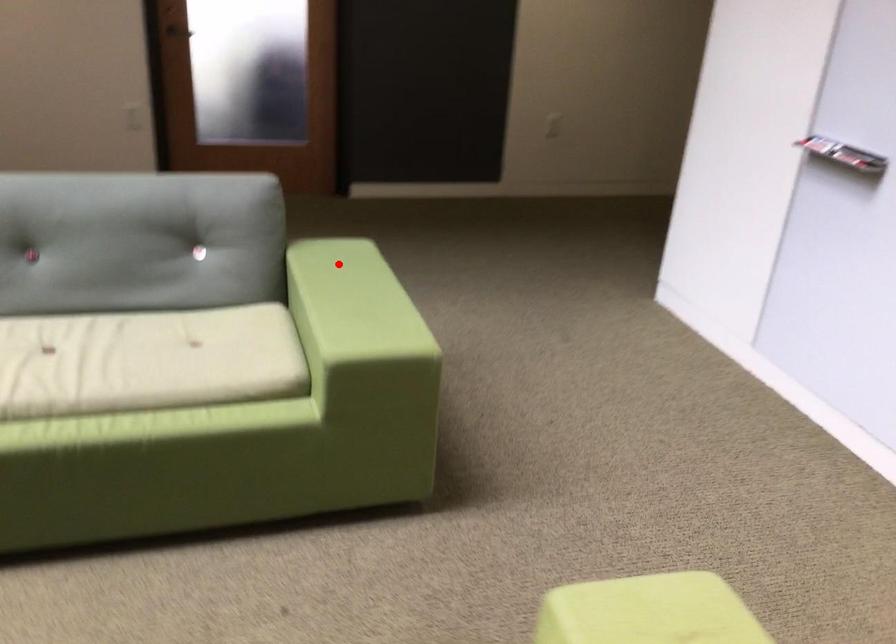
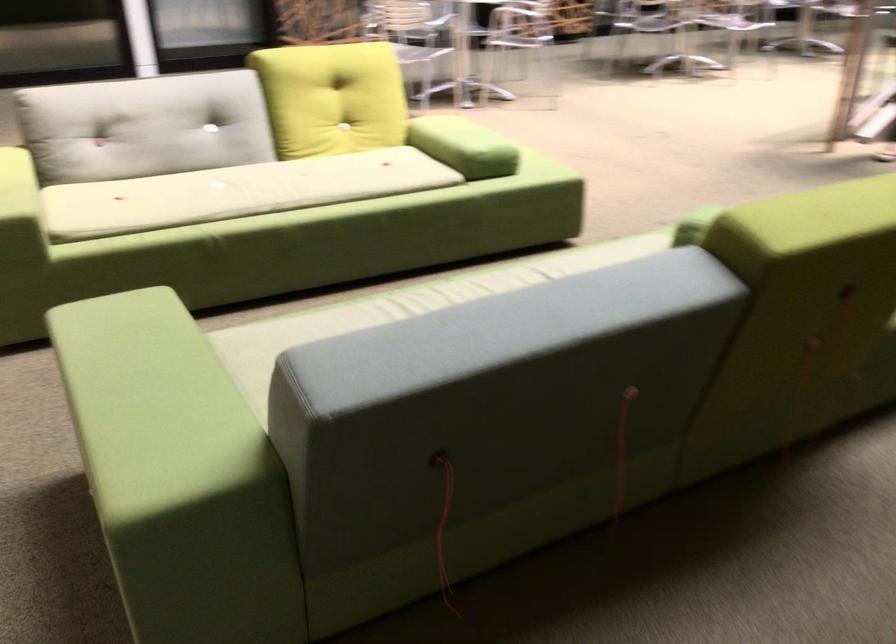
Find the pixel in the second image that matches the highlighted location in the first image.

(151, 404)